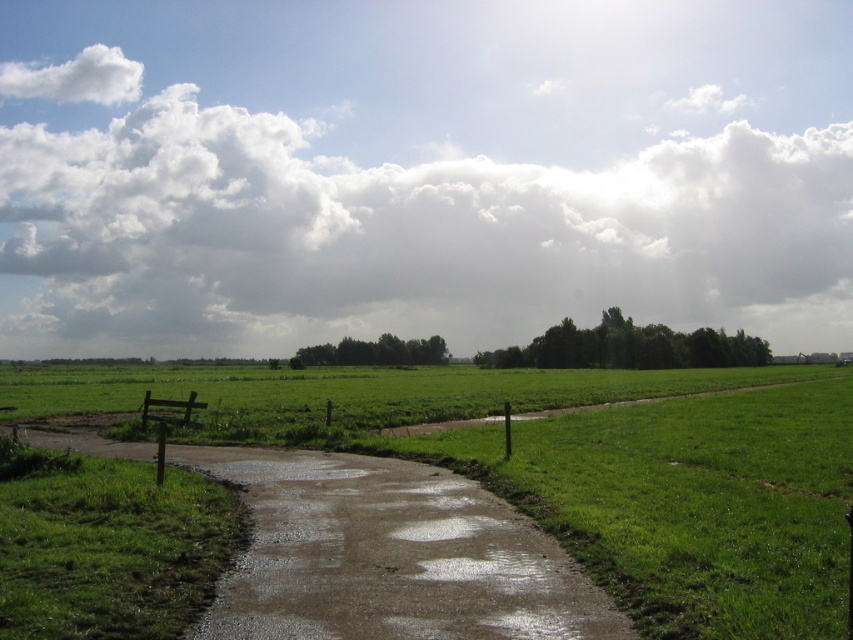
You are a photographer standing at the muddy concrete path at center, aiming to capture the white fluffy cloud at upper center in your shot. However, you notice an obstruction. Based on their positions, which object is closer to you and might block the view of the cloud?

The muddy concrete path at center is closer to you than the white fluffy cloud at upper center, so it might block the view of the cloud.

You are a hiker trying to decide which path to take in the rural landscape. You see the muddy concrete path at center and the green grassy path at center. Which path is narrower?

The muddy concrete path at center is narrower than the green grassy path at center.

You are a gardener who needs to determine the elevation difference between the muddy concrete path at center and the green grassy path at center. Which one is lower in elevation?

The muddy concrete path at center has a lesser height compared to the green grassy path at center, so the muddy concrete path at center is lower in elevation.